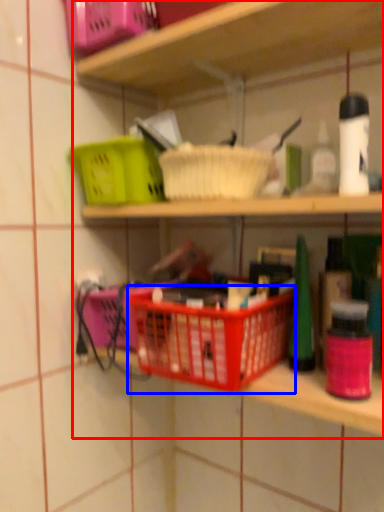
Question: Among these objects, which one is farthest to the camera, shelf (highlighted by a red box) or basket container (highlighted by a blue box)?

Choices:
 (A) shelf
 (B) basket container

Answer: (B)